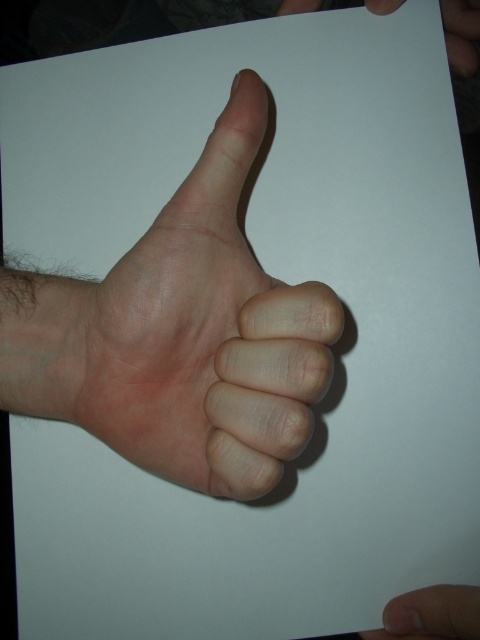
Does smooth skin at lower right come behind smooth skin hand at upper right?

No.

Does smooth skin at lower right have a larger size compared to smooth skin hand at upper right?

No.

Where is `smooth skin at lower right`? This screenshot has height=640, width=480. smooth skin at lower right is located at coordinates (431, 614).

Does pink flesh-colored hand at center have a greater height compared to smooth skin at lower right?

Yes, pink flesh-colored hand at center is taller than smooth skin at lower right.

Describe the element at coordinates (204, 333) in the screenshot. I see `pink flesh-colored hand at center` at that location.

What do you see at coordinates (204, 333) in the screenshot? The height and width of the screenshot is (640, 480). I see `pink flesh-colored hand at center` at bounding box center [204, 333].

The width and height of the screenshot is (480, 640). What are the coordinates of `pink flesh-colored hand at center` in the screenshot? It's located at (204, 333).

Which is behind, point (265, 468) or point (456, 49)?

Point (456, 49)

The image size is (480, 640). Identify the location of pink flesh-colored hand at center. (204, 333).